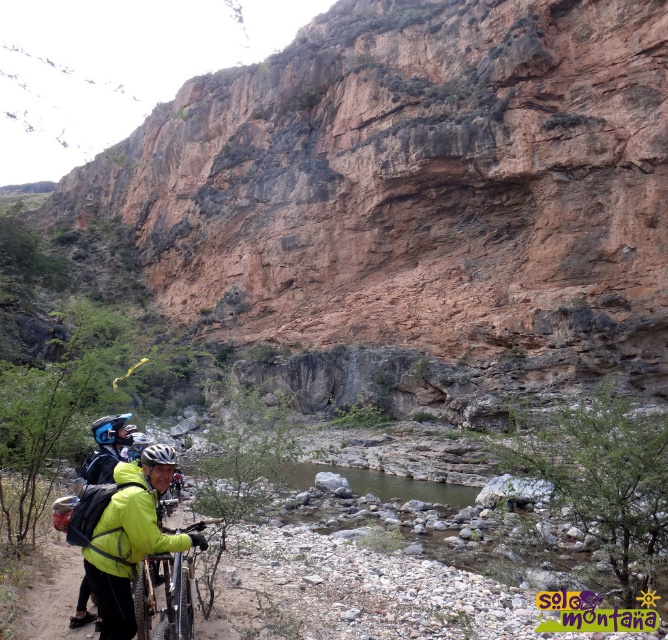
You are a hiker trying to locate a friend wearing a neon yellow jacket at center. According to the map coordinates, there is a point at (130, 538). Is this point on your friend?

Yes, the point at (130, 538) is on the neon yellow jacket at center, so it is on your friend.

You are a drone operator trying to capture a photo of the point at coordinates (144, 516) in the scene. The drone has a maximum flight range of 30 meters. Can the drone reach the point from its current position at the origin without exceeding its range?

The distance between the drone at the origin and the point at coordinates (144, 516) is 27.17 meters, which is within the drone operator maximum flight range of 30 meters. Yes, the drone can reach the point without exceeding its range.